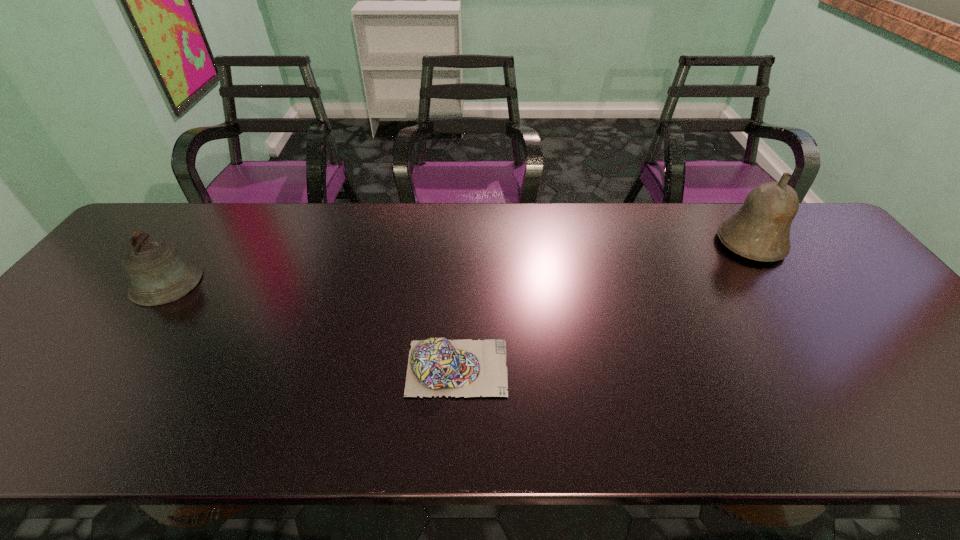
Locate an element on the screen. The width and height of the screenshot is (960, 540). vacant area that satisfies the following two spatial constraints: 1. on the back side of the second shortest object; 2. on the left side of the tallest object is located at coordinates (195, 244).